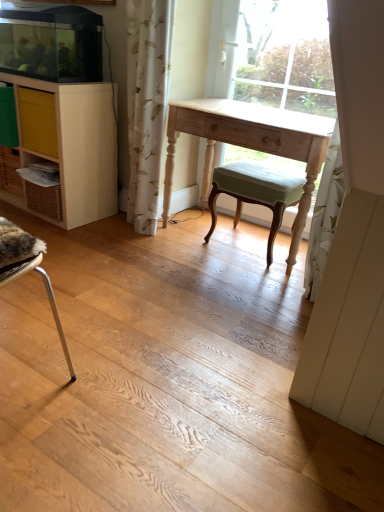
Identify the location of vacant area situated to the left side of light wood desk at center. The height and width of the screenshot is (512, 384). (129, 248).